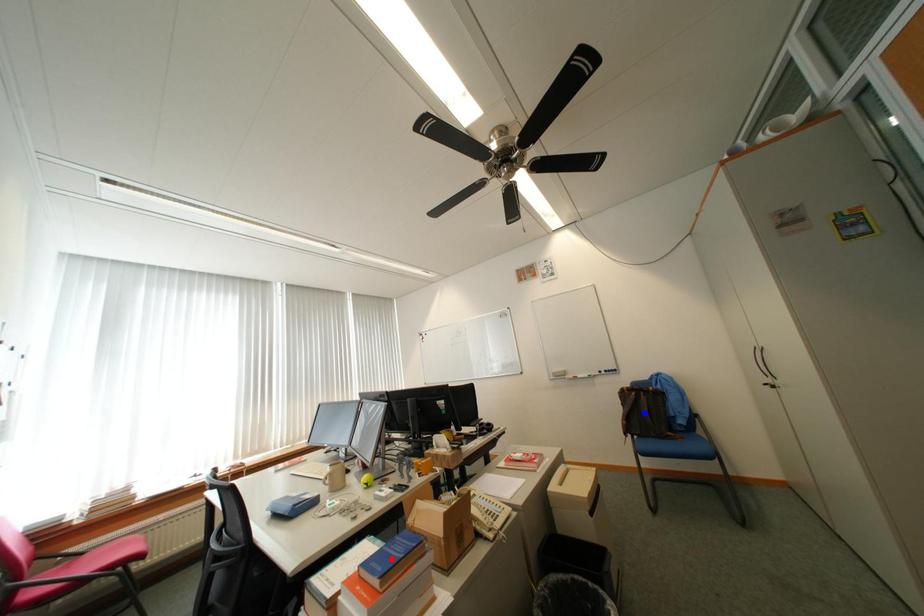
Question: In the image, two points are highlighted. Which point is nearer to the camera? Reply with the corresponding letter.

Choices:
 (A) blue point
 (B) red point

Answer: (B)